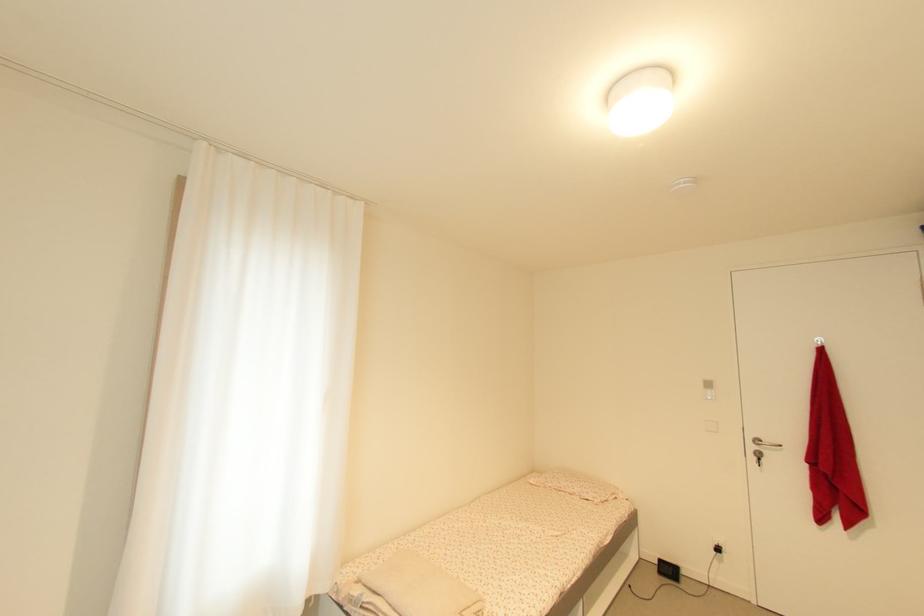
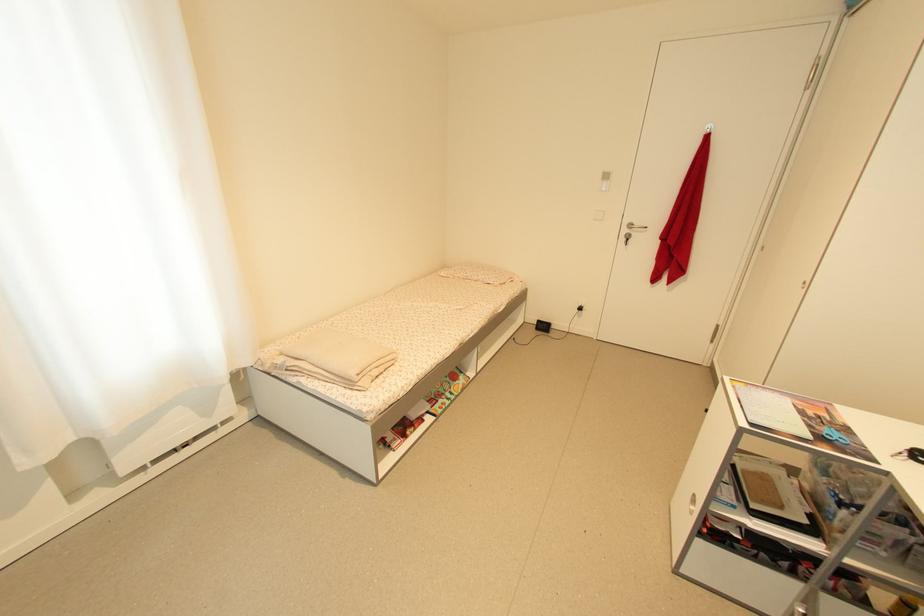
Locate, in the second image, the point that corresponds to point 758,460 in the first image.

(627, 241)